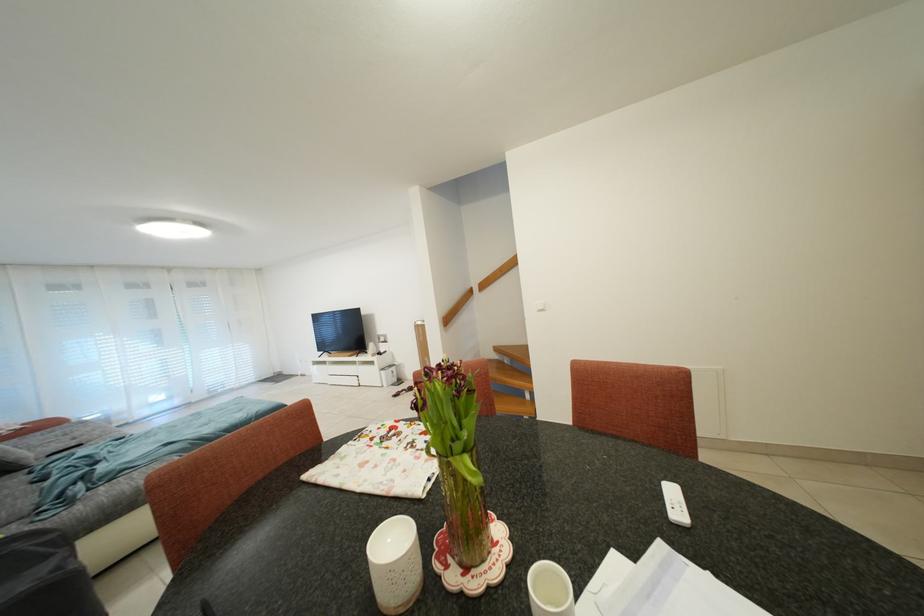
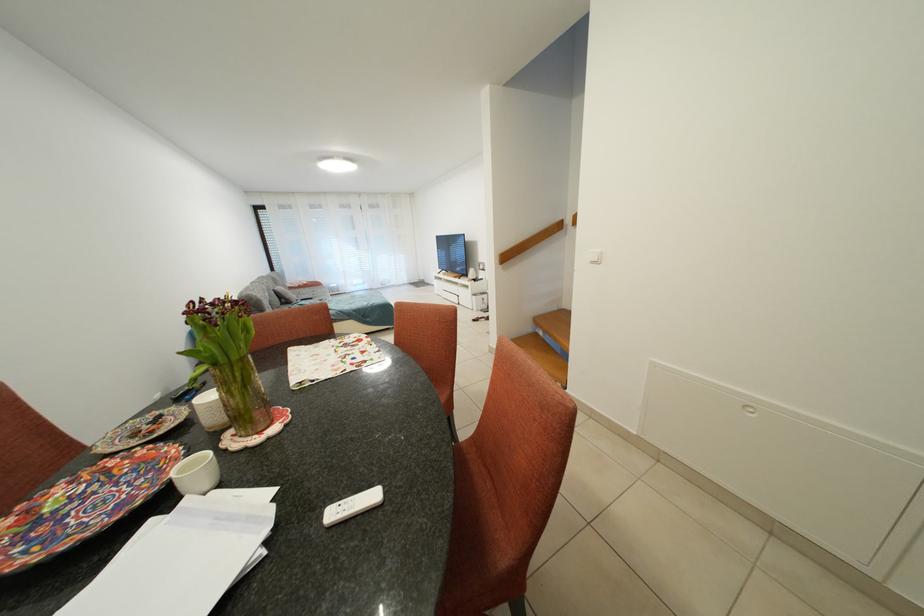
Locate, in the second image, the point that corresponds to point 186,406 in the first image.

(373, 291)